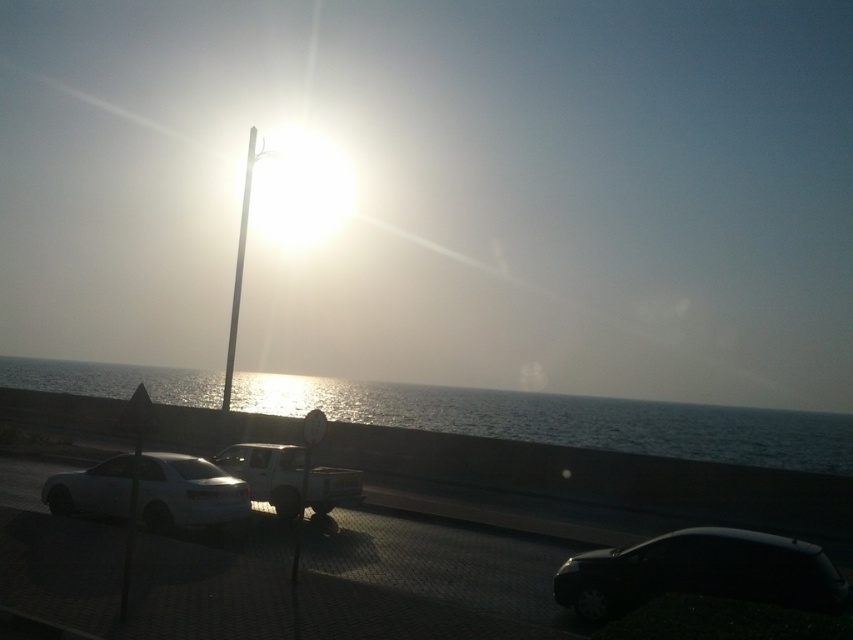
Measure the distance from white matte sedan at lower left to white glossy pole at center.

A distance of 12.83 meters exists between white matte sedan at lower left and white glossy pole at center.

Which is more to the right, white matte sedan at lower left or white glossy pole at center?

white matte sedan at lower left is more to the right.

Find the location of a particular element. This screenshot has width=853, height=640. white matte sedan at lower left is located at coordinates (151, 492).

Who is more forward, (395, 394) or (659, 563)?

Point (659, 563)

Is glistening water at center smaller than black glossy car at lower right?

No.

Looking at this image, who is more forward, (47,390) or (614,614)?

Point (614,614) is more forward.

The height and width of the screenshot is (640, 853). In order to click on glistening water at center in this screenshot , I will do `click(566, 420)`.

From the picture: Can you confirm if white matte sedan at lower left is positioned to the left of white matte truck at center?

Yes, white matte sedan at lower left is to the left of white matte truck at center.

Can you confirm if white matte sedan at lower left is smaller than white matte truck at center?

Indeed, white matte sedan at lower left has a smaller size compared to white matte truck at center.

Locate an element on the screen. white matte sedan at lower left is located at coordinates (151, 492).